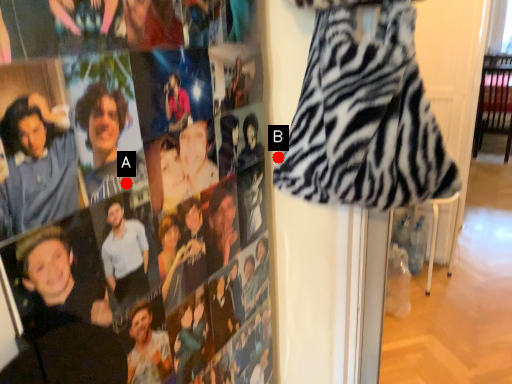
Question: Two points are circled on the image, labeled by A and B beside each circle. Which point appears closest to the camera in this image?

Choices:
 (A) A is closer
 (B) B is closer

Answer: (A)